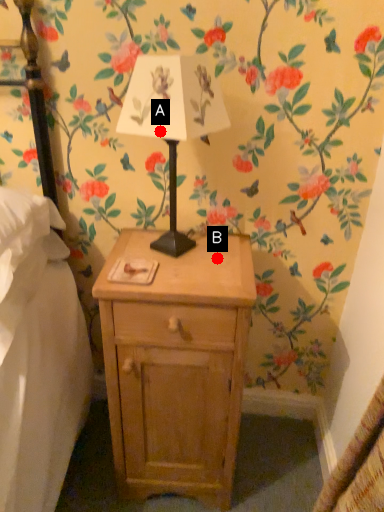
Question: Two points are circled on the image, labeled by A and B beside each circle. Which of the following is the farthest from the observer?

Choices:
 (A) A is further
 (B) B is further

Answer: (B)